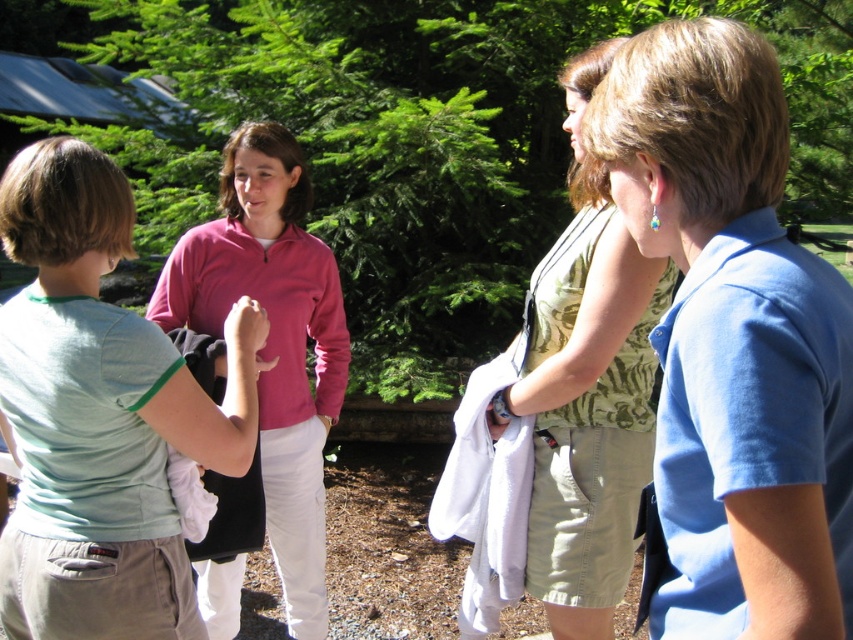
Question: Which object appears farthest from the camera in this image?

Choices:
 (A) blue cotton shirt at upper right
 (B) pink zip-up sweater at center
 (C) green textured blouse at center

Answer: (B)

Question: Does light green t-shirt at left lie in front of pink zip-up sweater at center?

Choices:
 (A) no
 (B) yes

Answer: (B)

Question: Which point is closer to the camera?

Choices:
 (A) pink zip-up sweater at center
 (B) light green t-shirt at left
 (C) blue cotton shirt at upper right
 (D) green textured blouse at center

Answer: (C)

Question: From the image, what is the correct spatial relationship of blue cotton shirt at upper right in relation to green textured blouse at center?

Choices:
 (A) left
 (B) right

Answer: (A)

Question: Among these objects, which one is nearest to the camera?

Choices:
 (A) blue cotton shirt at upper right
 (B) pink zip-up sweater at center
 (C) light green t-shirt at left
 (D) green textured blouse at center

Answer: (A)

Question: Considering the relative positions of blue cotton shirt at upper right and light green t-shirt at left in the image provided, where is blue cotton shirt at upper right located with respect to light green t-shirt at left?

Choices:
 (A) right
 (B) left

Answer: (A)